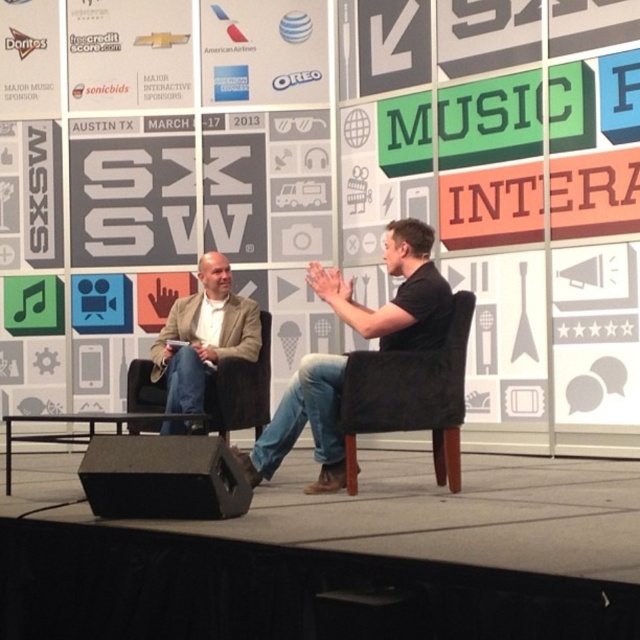
Question: Among these points, which one is nearest to the camera?

Choices:
 (A) (147, 444)
 (B) (186, 348)
 (C) (448, 355)
 (D) (387, 230)

Answer: (A)

Question: Which of the following is the closest to the observer?

Choices:
 (A) black matte speaker at lower left
 (B) light brown leather jacket at left

Answer: (A)

Question: Which point is closer to the camera?

Choices:
 (A) black leather chair at center
 (B) black fabric armchair at center
 (C) light brown leather jacket at left
 (D) black matte speaker at lower left

Answer: (D)

Question: Can you confirm if black leather chair at center is smaller than black matte speaker at lower left?

Choices:
 (A) yes
 (B) no

Answer: (B)

Question: In this image, where is black matte speaker at lower left located relative to light brown leather jacket at left?

Choices:
 (A) right
 (B) left

Answer: (A)

Question: Is black leather chair at center to the left of black fabric armchair at center from the viewer's perspective?

Choices:
 (A) no
 (B) yes

Answer: (B)